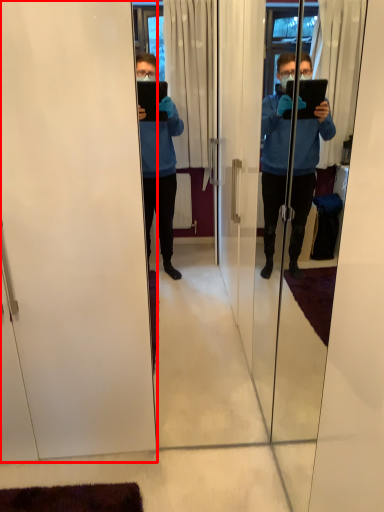
Question: Observing the image, what is the correct spatial positioning of screen door (annotated by the red box) in reference to screen door?

Choices:
 (A) left
 (B) right

Answer: (A)